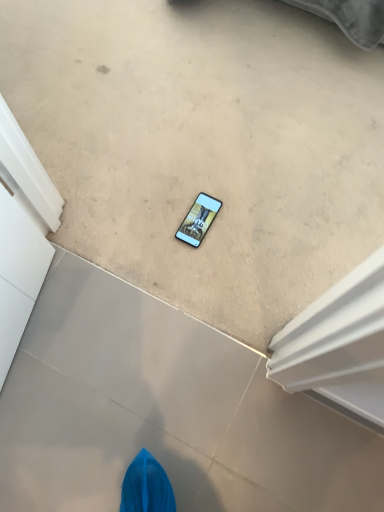
The image size is (384, 512). I want to click on free space above matte gray concrete at center, the 2th concrete in the top-to-bottom sequence (from a real-world perspective), so click(153, 409).